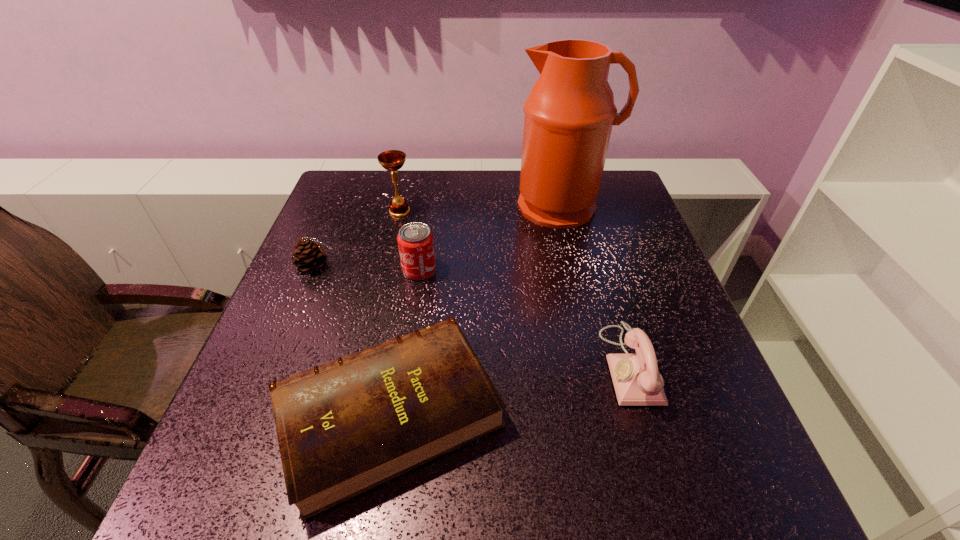
At what (x,y) coordinates should I click in order to perform the action: click on free location that satisfies the following two spatial constraints: 1. from the spout of the tallest object; 2. with a leaf charm attached to the fifth tallest object. Please return your answer as a coordinate pair (x, y). The image size is (960, 540). Looking at the image, I should click on (577, 266).

Where is `free space that satisfies the following two spatial constraints: 1. from the spout of the tallest object; 2. with a leaf charm attached to the second shortest object`? The image size is (960, 540). free space that satisfies the following two spatial constraints: 1. from the spout of the tallest object; 2. with a leaf charm attached to the second shortest object is located at coordinates (577, 266).

At what (x,y) coordinates should I click in order to perform the action: click on blank area in the image that satisfies the following two spatial constraints: 1. on the front side of the chalice; 2. on the right side of the can. Please return your answer as a coordinate pair (x, y). The image size is (960, 540). Looking at the image, I should click on (386, 270).

This screenshot has width=960, height=540. I want to click on free space that satisfies the following two spatial constraints: 1. on the front side of the can; 2. on the right side of the chalice, so click(386, 270).

The width and height of the screenshot is (960, 540). I want to click on free space that satisfies the following two spatial constraints: 1. from the spout of the tallest object; 2. with a leaf charm attached to the fifth tallest object, so click(577, 266).

At what (x,y) coordinates should I click in order to perform the action: click on free space that satisfies the following two spatial constraints: 1. with a leaf charm attached to the pinecone; 2. on the back side of the shortest object. Please return your answer as a coordinate pair (x, y). Looking at the image, I should click on click(255, 412).